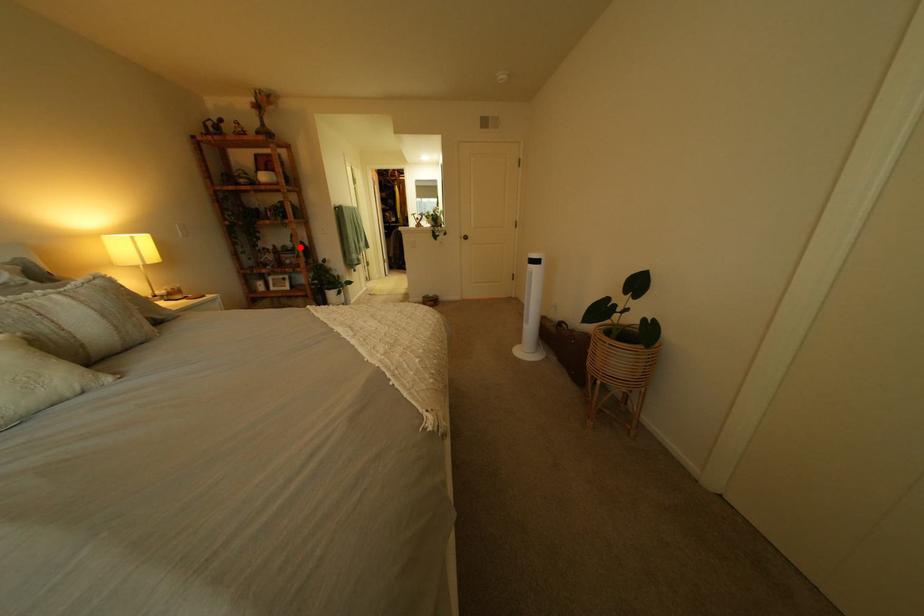
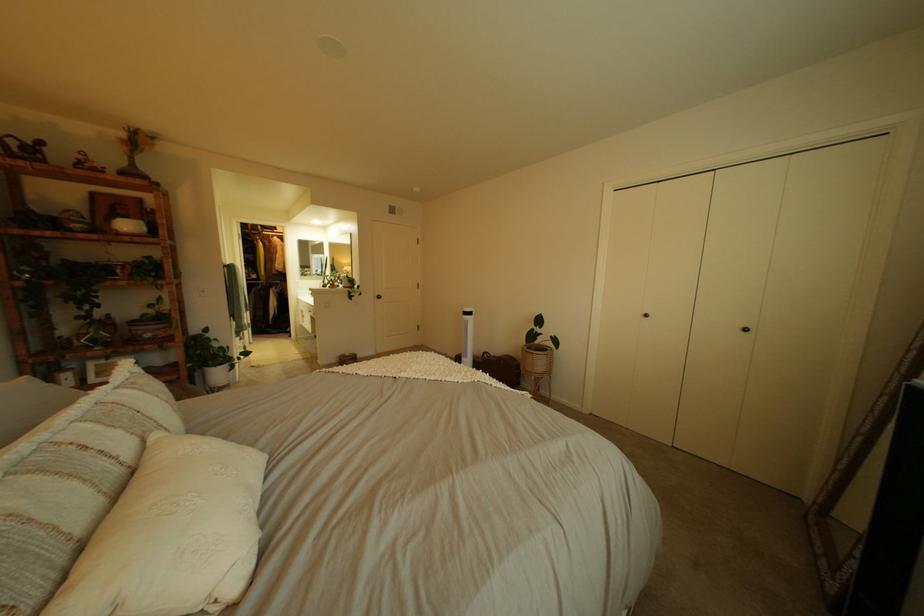
Question: A red point is marked in image1. In image2, is the corresponding 3D point closer to the camera or farther? Reply with the corresponding letter.

Choices:
 (A) The corresponding 3D point is closer.
 (B) The corresponding 3D point is farther.

Answer: (B)